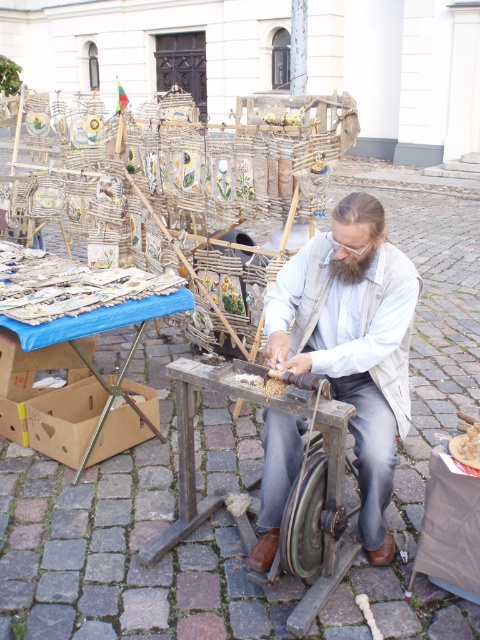
You are a customer at the fair and want to see the handmade items displayed behind the man. Can you see them clearly from your current position in front of the white cotton shirt at center and the green rubber wheel at center?

The green rubber wheel at center is behind the white cotton shirt at center, so the customer cannot see the items displayed behind the man clearly from their current position in front of the white cotton shirt at center and the green rubber wheel at center.

You are a customer at the market and see the white cotton shirt at center and the green rubber wheel at center. Which item is located to the right of the other?

The white cotton shirt at center is positioned on the right side of green rubber wheel at center.

You are a customer observing the craftsman and his tools. Which object is taller between the white cotton shirt at center and the green rubber wheel at center?

The white cotton shirt at center is taller than the green rubber wheel at center according to the description.